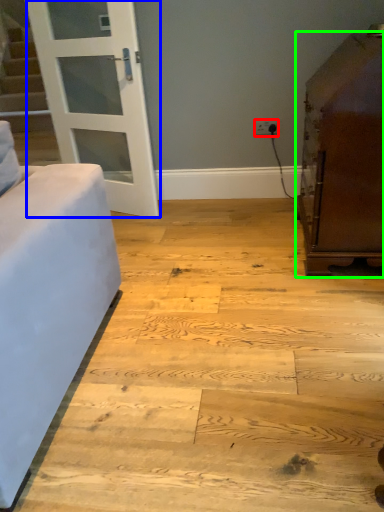
Question: Estimate the real-world distances between objects in this image. Which object is closer to electric outlet (highlighted by a red box), door (highlighted by a blue box) or furniture (highlighted by a green box)?

Choices:
 (A) door
 (B) furniture

Answer: (B)